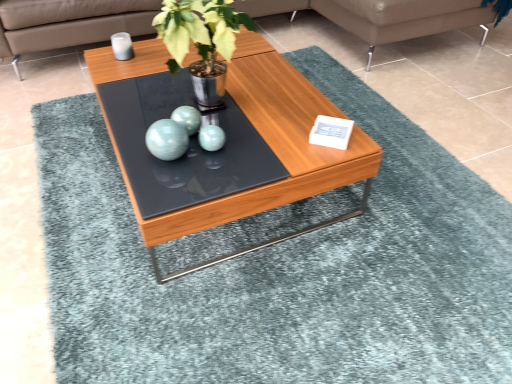
What is the approximate height of leather couch at upper center?

The height of leather couch at upper center is 17.19 inches.

Image resolution: width=512 pixels, height=384 pixels. Identify the location of leather couch at upper center. 68,23.

What is the approximate width of metallic green plant at center?

35.28 centimeters.

Locate an element on the screen. wooden coffee table at center is located at coordinates (249, 125).

Locate an element on the screen. The width and height of the screenshot is (512, 384). teal glossy sphere at center is located at coordinates (182, 134).

Does teal glossy sphere at center come behind leather couch at upper center?

No, teal glossy sphere at center is in front of leather couch at upper center.

Between teal glossy sphere at center and leather couch at upper center, which one has larger width?

leather couch at upper center is wider.

From a real-world perspective, does teal glossy sphere at center sit lower than leather couch at upper center?

Answer: No, from a real-world perspective, teal glossy sphere at center is not under leather couch at upper center.

Are teal glossy sphere at center and leather couch at upper center far apart?

→ Absolutely, teal glossy sphere at center is distant from leather couch at upper center.

From a real-world perspective, does leather couch at upper center sit lower than teal glossy sphere at center?

Yes, from a real-world perspective, leather couch at upper center is beneath teal glossy sphere at center.

Is leather couch at upper center turned away from teal glossy sphere at center?

That's not correct — leather couch at upper center is not looking away from teal glossy sphere at center.

In terms of width, does leather couch at upper center look wider or thinner when compared to teal glossy sphere at center?

Considering their sizes, leather couch at upper center looks broader than teal glossy sphere at center.

Looking at this image, between leather couch at upper center and teal glossy sphere at center, which one has less height?

With less height is teal glossy sphere at center.

Can you tell me how much metallic green plant at center and wooden coffee table at center differ in facing direction?

8.54e-05 degrees.

Which object is more forward, metallic green plant at center or wooden coffee table at center?

metallic green plant at center.

Is metallic green plant at center oriented away from wooden coffee table at center?

No, wooden coffee table at center is not at the back of metallic green plant at center.

Would you say metallic green plant at center is outside wooden coffee table at center?

Indeed, metallic green plant at center is completely outside wooden coffee table at center.

Where is `couch that appears behind the wooden coffee table at center`? The height and width of the screenshot is (384, 512). couch that appears behind the wooden coffee table at center is located at coordinates (402, 18).

Is wooden coffee table at center facing away from leather couch at upper right?

wooden coffee table at center does not have its back to leather couch at upper right.

From a real-world perspective, is wooden coffee table at center physically above leather couch at upper right?

No, from a real-world perspective, wooden coffee table at center is not above leather couch at upper right.

How distant is wooden coffee table at center from leather couch at upper right?

A distance of 3.45 feet exists between wooden coffee table at center and leather couch at upper right.

Are teal glossy sphere at center and leather couch at upper right located far from each other?

Indeed, teal glossy sphere at center is not near leather couch at upper right.

Relative to leather couch at upper right, is teal glossy sphere at center in front or behind?

teal glossy sphere at center is in front of leather couch at upper right.

Which of these two, teal glossy sphere at center or leather couch at upper right, stands taller?

leather couch at upper right is taller.

Is leather couch at upper center directly adjacent to leather couch at upper right?

Yes, leather couch at upper center is beside leather couch at upper right.

Does leather couch at upper center have a lesser width compared to leather couch at upper right?

Yes.

Is leather couch at upper center outside of leather couch at upper right?

Indeed, leather couch at upper center is completely outside leather couch at upper right.

Which is in front, point (109, 31) or point (380, 0)?

The point (380, 0) is in front.

Is leather couch at upper right looking in the opposite direction of leather couch at upper center?

No, leather couch at upper center is not at the back of leather couch at upper right.

Does leather couch at upper right have a greater width compared to leather couch at upper center?

Yes.

Considering the positions of objects leather couch at upper right and leather couch at upper center in the image provided, who is in front, leather couch at upper right or leather couch at upper center?

leather couch at upper center is closer to the camera.

Can you confirm if leather couch at upper right is positioned to the left of leather couch at upper center?

Incorrect, leather couch at upper right is not on the left side of leather couch at upper center.

Where is `studio couch located underneath the teal glossy sphere at center (from a real-world perspective)`? studio couch located underneath the teal glossy sphere at center (from a real-world perspective) is located at coordinates (68, 23).

Find the location of a particular element. teal that is below the leather couch at upper center (from the image's perspective) is located at coordinates (182, 134).

Based on the photo, estimate the real-world distances between objects in this image. Which object is further from leather couch at upper right, metallic green plant at center or teal glossy sphere at center?

teal glossy sphere at center is positioned further to the anchor leather couch at upper right.

From the image, which object appears to be nearer to metallic green plant at center, wooden coffee table at center or leather couch at upper center?

Based on the image, wooden coffee table at center appears to be nearer to metallic green plant at center.

Estimate the real-world distances between objects in this image. Which object is closer to leather couch at upper center, teal glossy sphere at center or leather couch at upper right?

leather couch at upper right.

Based on their spatial positions, is wooden coffee table at center or leather couch at upper right closer to leather couch at upper center?

leather couch at upper right is closer to leather couch at upper center.

Which object lies nearer to the anchor point metallic green plant at center, wooden coffee table at center or leather couch at upper right?

Based on the image, wooden coffee table at center appears to be nearer to metallic green plant at center.

Looking at this image, based on their spatial positions, is teal glossy sphere at center or metallic green plant at center further from leather couch at upper center?

Among the two, teal glossy sphere at center is located further to leather couch at upper center.

Which object lies nearer to the anchor point leather couch at upper right, wooden coffee table at center or metallic green plant at center?

wooden coffee table at center.

Considering their positions, is wooden coffee table at center positioned closer to leather couch at upper center than teal glossy sphere at center?

wooden coffee table at center is closer to leather couch at upper center.

The image size is (512, 384). I want to click on houseplant located between teal glossy sphere at center and leather couch at upper right in the left-right direction, so click(x=201, y=42).

What are the coordinates of `houseplant between leather couch at upper center and teal glossy sphere at center in the up-down direction` in the screenshot? It's located at (201, 42).

Identify the location of coffee table between metallic green plant at center and leather couch at upper center in the front-back direction. The width and height of the screenshot is (512, 384). (249, 125).

Locate an element on the screen. teal between leather couch at upper center and leather couch at upper right is located at coordinates (182, 134).